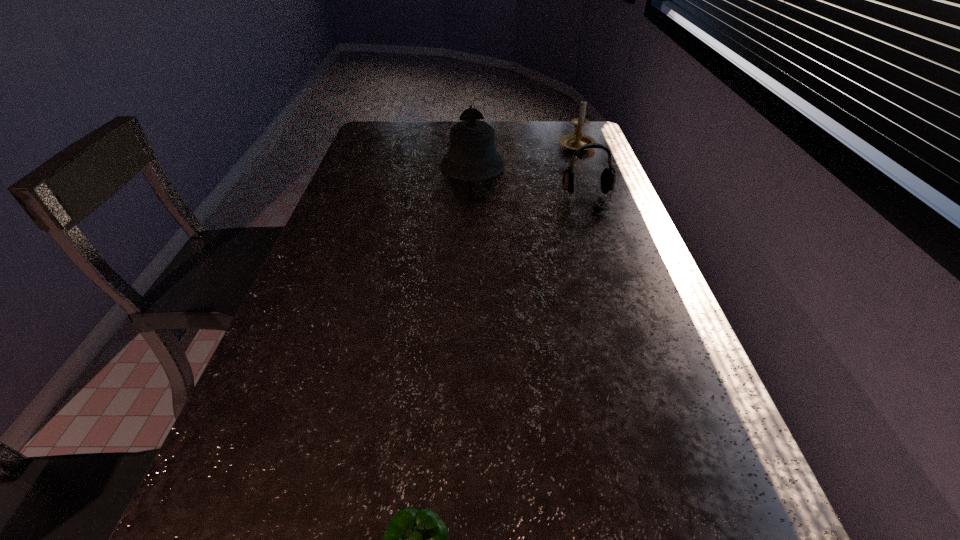
I want to click on blank area at the far edge, so click(432, 140).

In the image, there is a desktop. Identify the location of free space at the left edge. (365, 169).

Find the location of a particular element. This screenshot has width=960, height=540. free space at the far left corner of the desktop is located at coordinates (398, 141).

The image size is (960, 540). Identify the location of free spot between the tallest object and the candle holder. (524, 155).

You are a GUI agent. You are given a task and a screenshot of the screen. Output one action in this format:
    pyautogui.click(x=<x>, y=<y>)
    Task: Click on the unoccupied area between the candle holder and the second nearest object
    The height and width of the screenshot is (540, 960).
    Given the screenshot: What is the action you would take?
    pyautogui.click(x=582, y=172)

Identify which object is located as the second nearest to the candle holder. Please provide its 2D coordinates. Your answer should be formatted as a tuple, i.e. [(x, y)], where the tuple contains the x and y coordinates of a point satisfying the conditions above.

[(608, 177)]

I want to click on object that can be found as the second closest to the candle holder, so click(x=608, y=177).